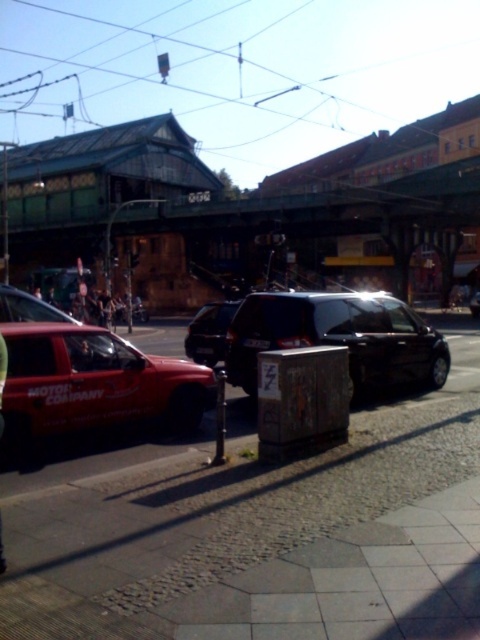
Question: From the image, what is the correct spatial relationship of shiny black car at center in relation to brushed metal construction worker at left?

Choices:
 (A) above
 (B) below

Answer: (A)

Question: Estimate the real-world distances between objects in this image. Which object is closer to the shiny black car at center?

Choices:
 (A) cobblestone pavement at center
 (B) matte red suv at left
 (C) brushed metal construction worker at left

Answer: (B)

Question: Is cobblestone pavement at center positioned at the back of brushed metal construction worker at left?

Choices:
 (A) no
 (B) yes

Answer: (A)

Question: Which point is closer to the camera?

Choices:
 (A) brushed metal construction worker at left
 (B) matte red suv at left
 (C) cobblestone pavement at center

Answer: (C)

Question: Estimate the real-world distances between objects in this image. Which object is farther from the shiny black car at center?

Choices:
 (A) cobblestone pavement at center
 (B) shiny black van at center

Answer: (A)

Question: Does cobblestone pavement at center have a larger size compared to shiny black van at center?

Choices:
 (A) no
 (B) yes

Answer: (A)